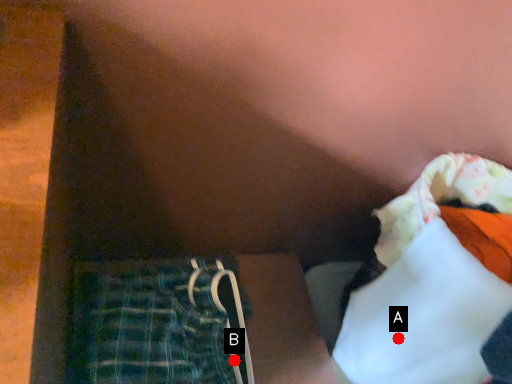
Question: Two points are circled on the image, labeled by A and B beside each circle. Which of the following is the closest to the observer?

Choices:
 (A) A is closer
 (B) B is closer

Answer: (A)